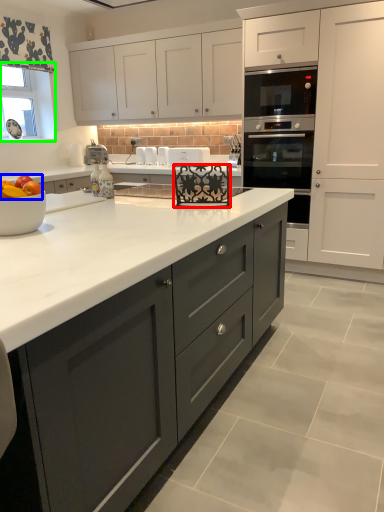
Question: Estimate the real-world distances between objects in this image. Which object is closer to appliance (highlighted by a red box), apple (highlighted by a blue box) or window screen (highlighted by a green box)?

Choices:
 (A) apple
 (B) window screen

Answer: (A)